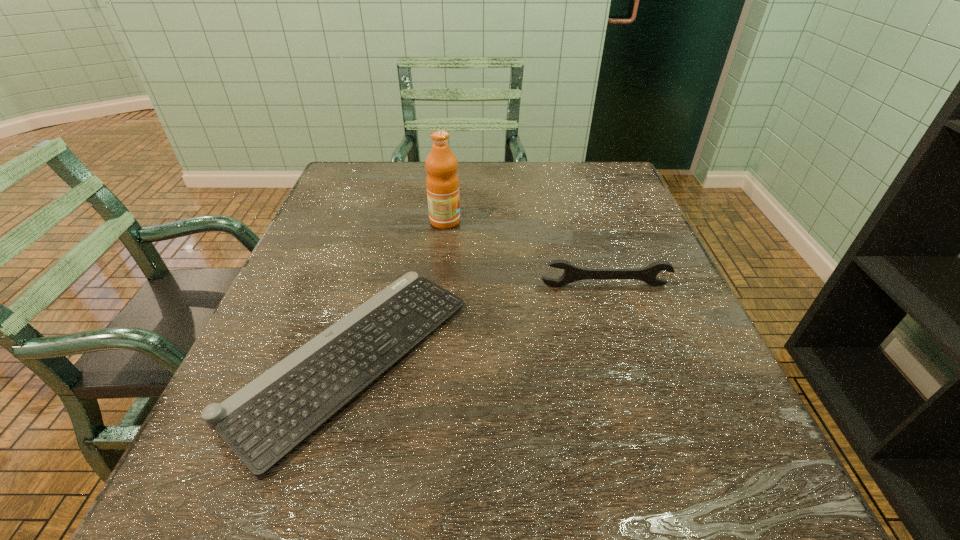
At what (x,y) coordinates should I click in order to perform the action: click on vacant space that is in between the farthest object and the second shortest object. Please return your answer as a coordinate pair (x, y). This screenshot has height=540, width=960. Looking at the image, I should click on (525, 254).

Identify the location of blank region between the computer keyboard and the wrench. The width and height of the screenshot is (960, 540). (478, 322).

The image size is (960, 540). I want to click on object that can be found as the second closest to the computer keyboard, so (x=442, y=182).

At what (x,y) coordinates should I click in order to perform the action: click on the closest object to the second shortest object. Please return your answer as a coordinate pair (x, y). Looking at the image, I should click on tap(264, 421).